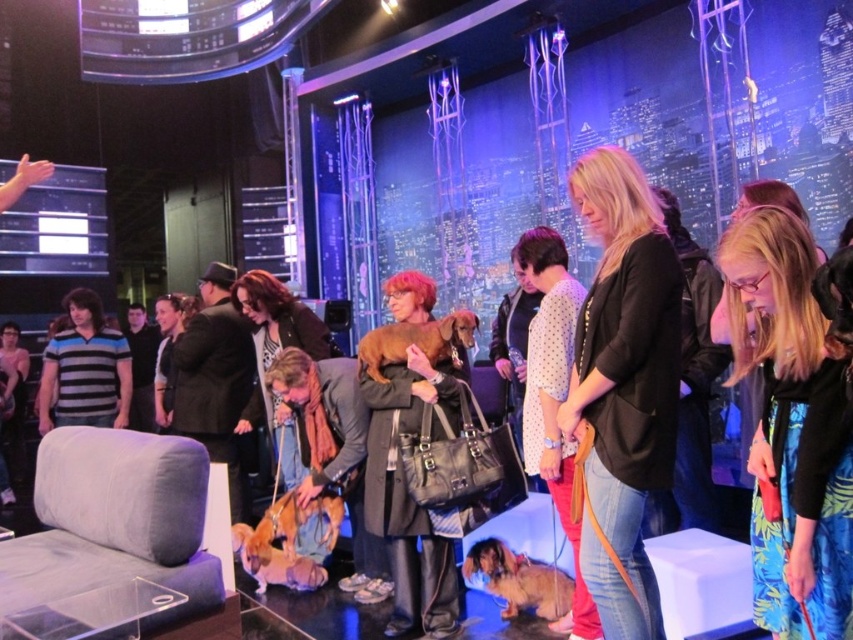
Who is shorter, matte brown coat at center or brown fur dog at center?

With less height is brown fur dog at center.

Is point (363, 355) farther from camera compared to point (258, 556)?

No, (363, 355) is closer to viewer.

What do you see at coordinates (405, 484) in the screenshot?
I see `matte brown coat at center` at bounding box center [405, 484].

The height and width of the screenshot is (640, 853). Identify the location of matte brown coat at center. (405, 484).

Between point (636, 198) and point (421, 396), which one is positioned behind?

The point (421, 396) is behind.

Does black matte blazer at center appear on the left side of matte brown coat at center?

No, black matte blazer at center is not to the left of matte brown coat at center.

You are a GUI agent. You are given a task and a screenshot of the screen. Output one action in this format:
    pyautogui.click(x=<x>, y=<y>)
    Task: Click on the black matte blazer at center
    This screenshot has width=853, height=640.
    Given the screenshot: What is the action you would take?
    pyautogui.click(x=624, y=385)

Is striped cotton shirt at left positioned before matte black coat at center?

No, striped cotton shirt at left is further to the viewer.

Does striped cotton shirt at left have a lesser height compared to matte black coat at center?

No, striped cotton shirt at left is not shorter than matte black coat at center.

Which is behind, point (120, 358) or point (161, 400)?

Point (161, 400)

At what (x,y) coordinates should I click in order to perform the action: click on striped cotton shirt at left. Please return your answer as a coordinate pair (x, y). The image size is (853, 640). Looking at the image, I should click on (85, 369).